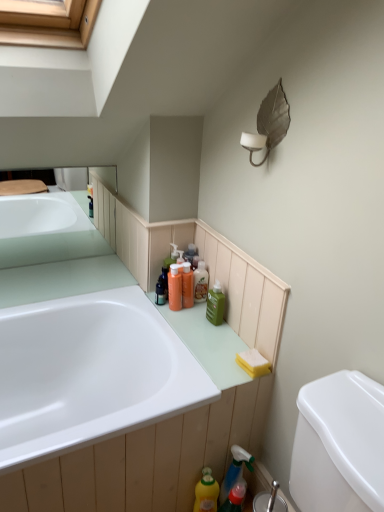
Identify the location of free location in front of green matte bottle at upper right, placed as the 1th cleaning product when sorted from top to bottom. Image resolution: width=384 pixels, height=512 pixels. (214, 343).